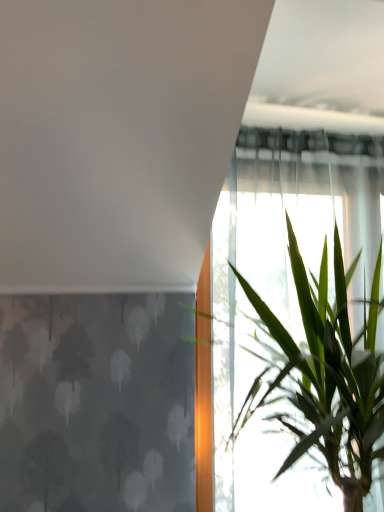
You are a GUI agent. You are given a task and a screenshot of the screen. Output one action in this format:
    pyautogui.click(x=<x>, y=<y>)
    Task: Click on the green leafy plant at right
    The image size is (384, 512).
    Given the screenshot: What is the action you would take?
    pyautogui.click(x=324, y=373)

What do you see at coordinates (324, 373) in the screenshot? I see `green leafy plant at right` at bounding box center [324, 373].

Find the location of a particular element. green leafy plant at right is located at coordinates (324, 373).